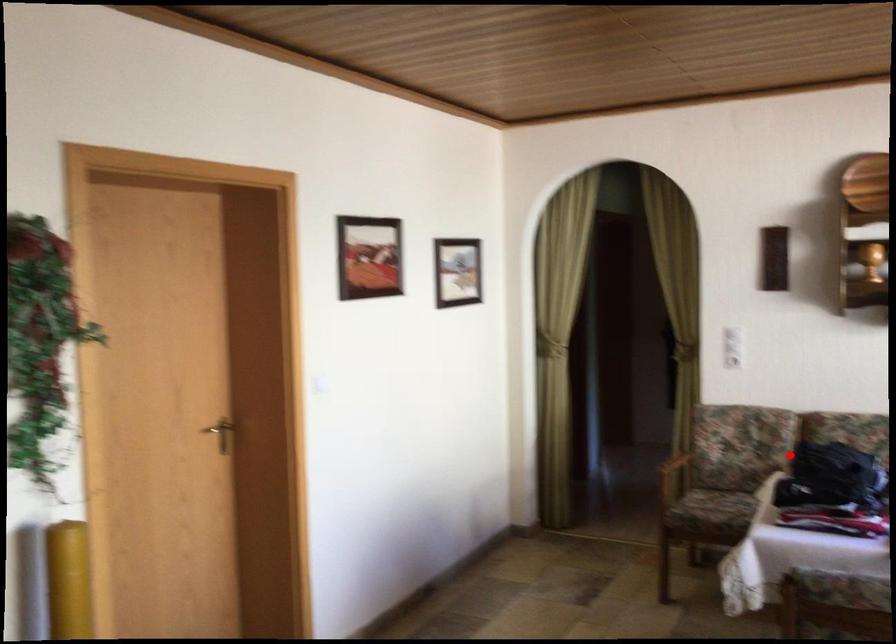
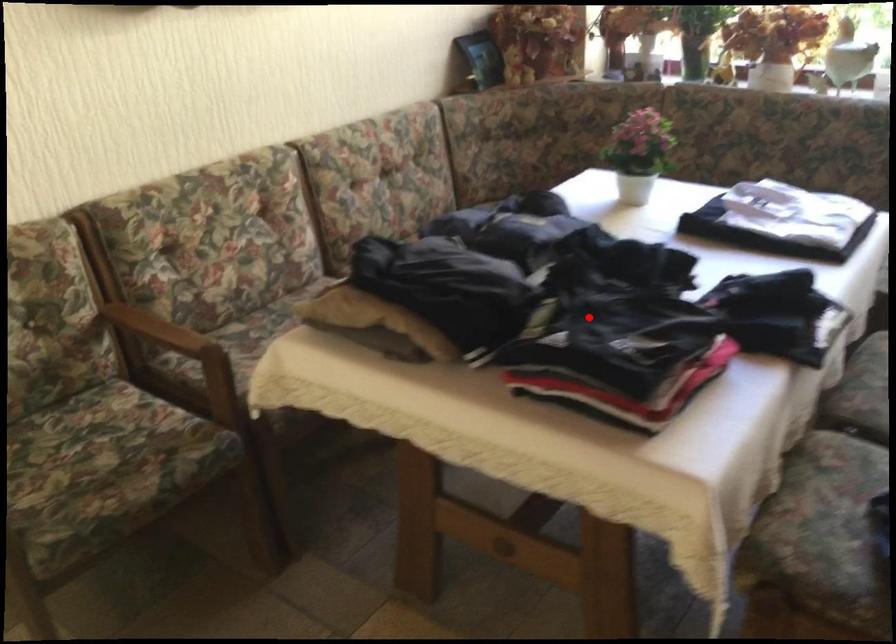
I am providing you with two images of the same scene from different viewpoints. A red point is marked on the first image and another point is marked on the second image. Does the point marked in image1 correspond to the same location as the one in image2?

No